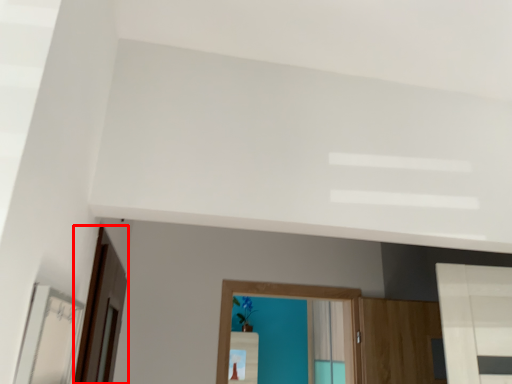
Question: From the image's perspective, what is the correct spatial relationship of screen door (annotated by the red box) in relation to mirror?

Choices:
 (A) below
 (B) above

Answer: (A)